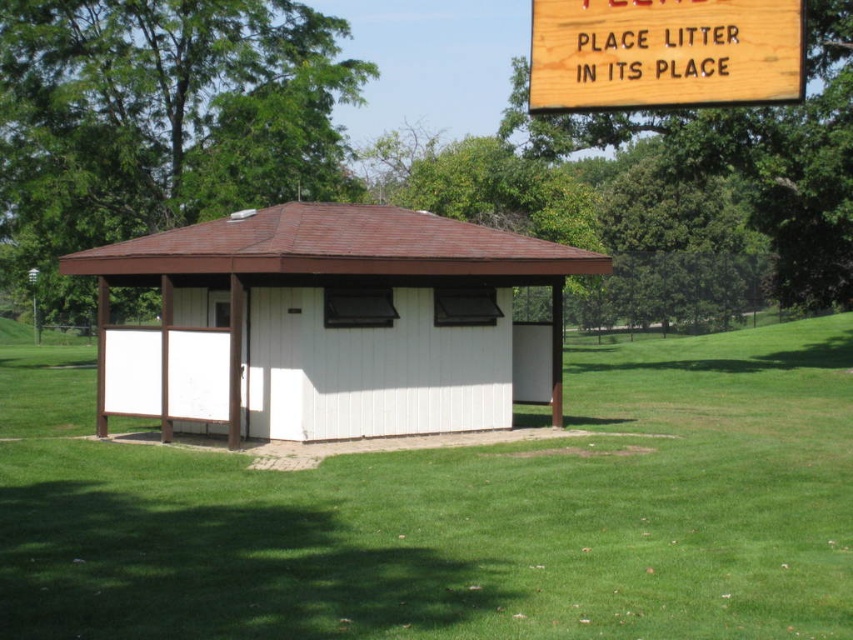
You are standing in front of the building and want to walk from the paved area to the structure. Which point, point (808, 552) or point (766, 19), is closer to you?

Point (808, 552) is closer to the viewer than point (766, 19), so you would reach point (808, 552) first.

You are standing in front of the structure and want to walk from point [323,250] to point [689,67]. Which direction should you move relative to the structure?

You should move away from the structure because point [323,250] is closer to you than point [689,67].

You are planning to host a picnic and need to determine where to place a large blanket. Given the scene, which area has more space for the blanket between the green grass at center and the white wood hut at center?

The green grass at center has a larger width than the white wood hut at center, so the green grass at center provides more space for the picnic blanket.